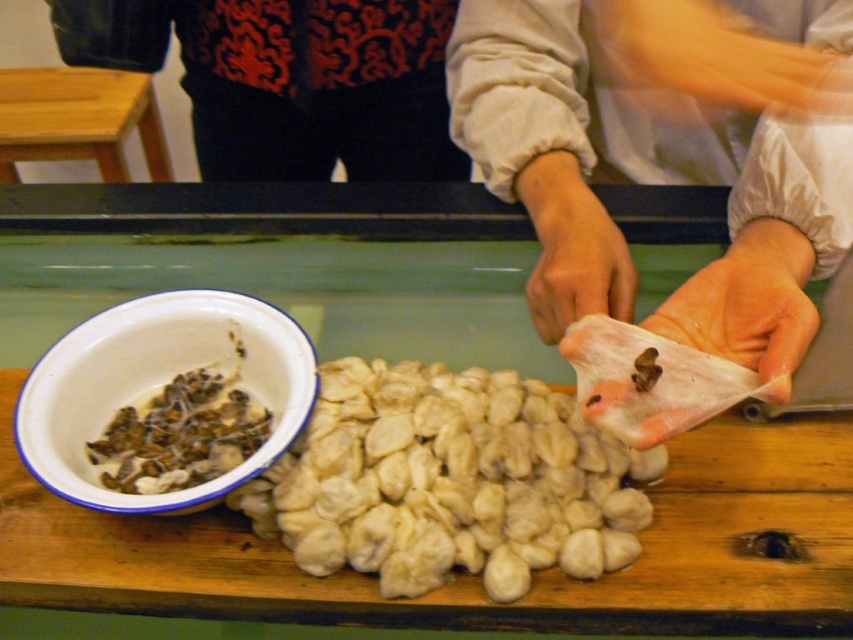
Who is more forward, [607,232] or [306,45]?

Point [607,232]

The width and height of the screenshot is (853, 640). I want to click on white paper at center, so click(659, 182).

Where is `white paper at center`? The height and width of the screenshot is (640, 853). white paper at center is located at coordinates [659, 182].

Is patterned fabric shirt at upper center below white enamel bowl at lower left?

Incorrect, patterned fabric shirt at upper center is not positioned below white enamel bowl at lower left.

What do you see at coordinates (289, 81) in the screenshot? I see `patterned fabric shirt at upper center` at bounding box center [289, 81].

Which is behind, point (161, 22) or point (22, 426)?

The point (161, 22) is behind.

This screenshot has height=640, width=853. In order to click on patterned fabric shirt at upper center in this screenshot , I will do pyautogui.click(x=289, y=81).

Which is above, white paper at center or brown matte mushrooms at left?

→ Positioned higher is white paper at center.

Does white paper at center have a greater width compared to brown matte mushrooms at left?

Yes.

Between point (838, 140) and point (117, 436), which one is positioned behind?

Positioned behind is point (117, 436).

Find the location of a particular element. This screenshot has width=853, height=640. white paper at center is located at coordinates (659, 182).